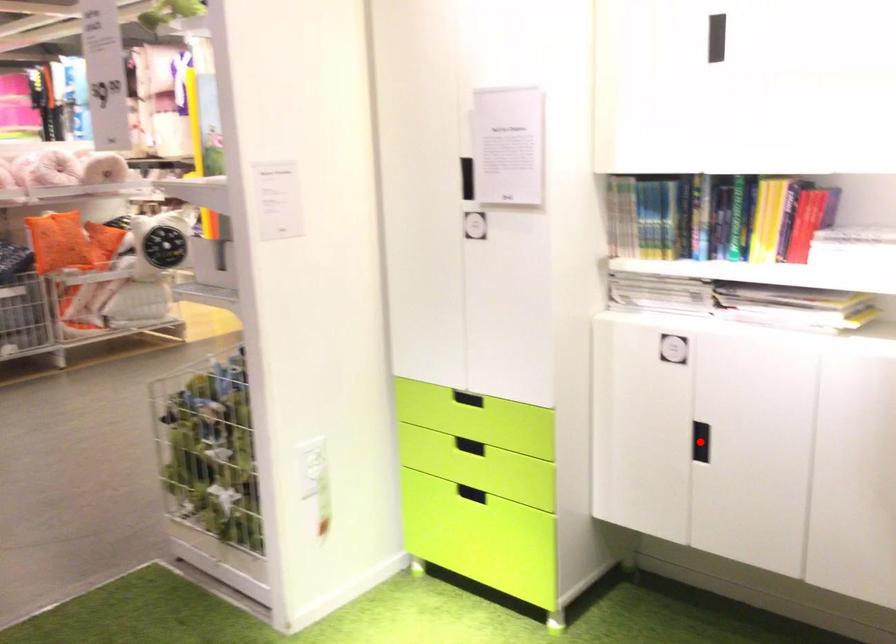
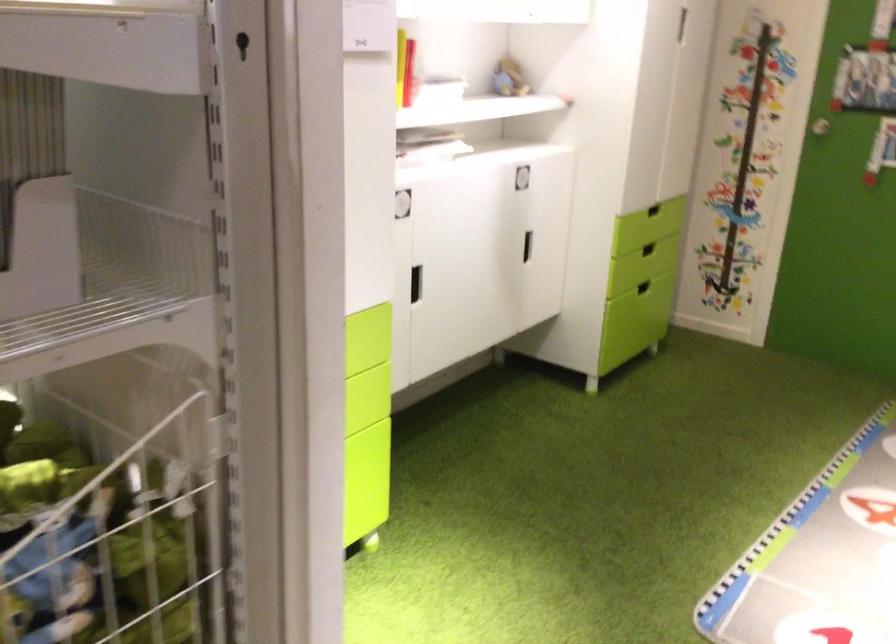
Question: I am providing you with two images of the same scene from different viewpoints. A red point is marked on the first image. Is the red point's position out of view in image 2?

Choices:
 (A) Yes
 (B) No

Answer: (A)